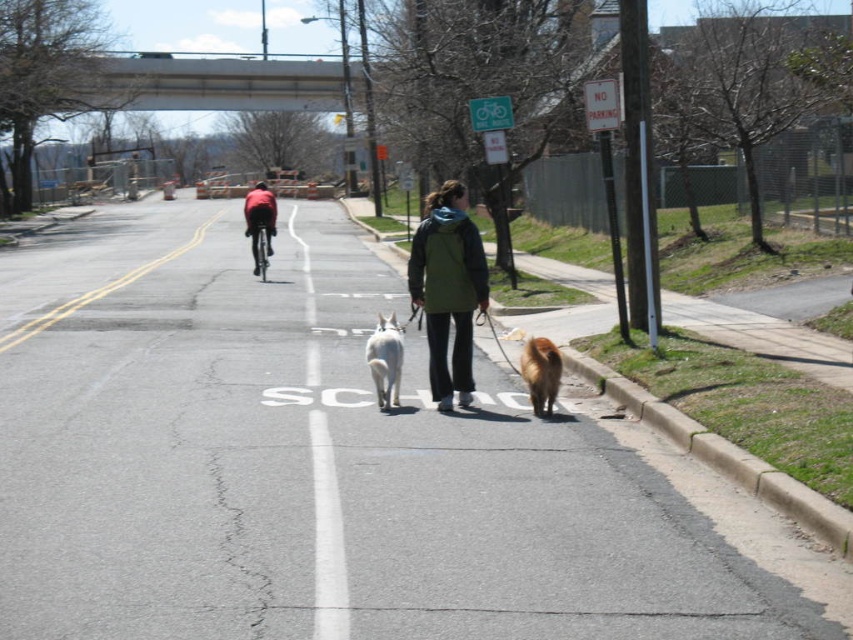
You are a pedestrian standing at the edge of the road and see the red fabric jacket at center and the shiny metallic bicycle at center. Which object is closer to you?

The red fabric jacket at center is closer to you because it is further to the viewer than the shiny metallic bicycle at center.

You are standing at the camera position and want to throw a ball to reach the green matte jacket at center. If the ball travels in a straight line, will it pass over the SCHOOL sign painted on the road?

The green matte jacket at center is 9.18 meters away from the camera. Since the SCHOOL sign is on the road between the camera and the jacket, the ball will pass over the SCHOOL sign painted on the road.

In the scene shown: You are a delivery drone trying to navigate between the green matte jacket at center and the SCHOOL sign on the road. According to the coordinates provided, which object is closer to the drone if it is positioned at the origin point?

The green matte jacket at center is located at point [448,289], which is closer to the origin than the SCHOOL sign. Therefore, the green matte jacket at center is closer to the drone.